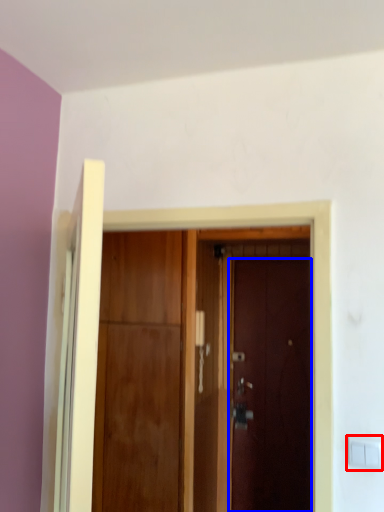
Question: Which of the following is the farthest to the observer, light switch (highlighted by a red box) or door (highlighted by a blue box)?

Choices:
 (A) light switch
 (B) door

Answer: (B)